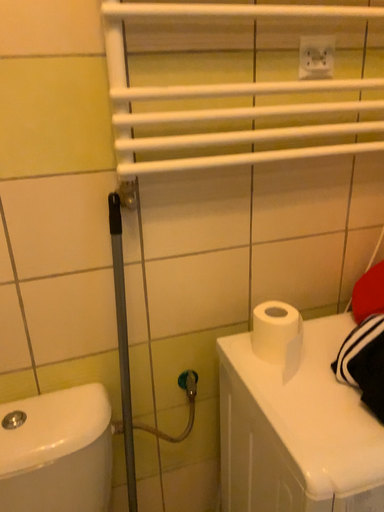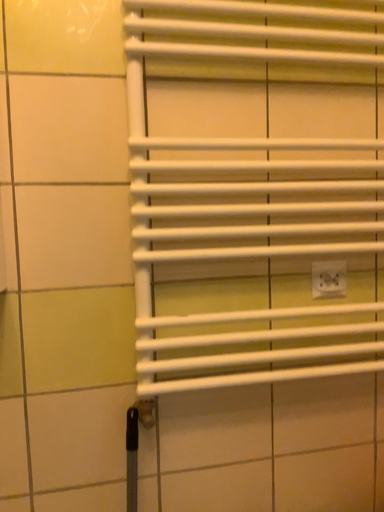
Question: Which way did the camera rotate in the video?

Choices:
 (A) rotated upward
 (B) rotated downward

Answer: (A)